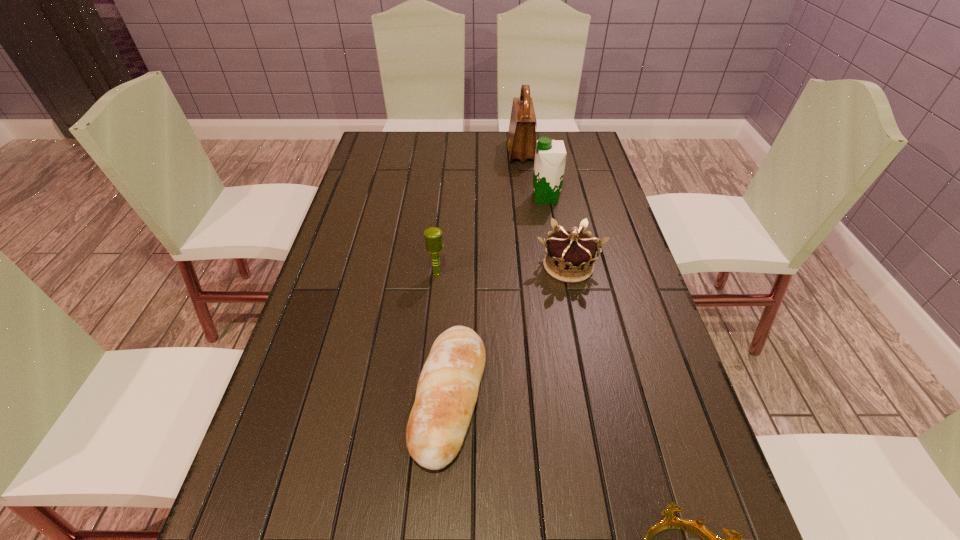
At what (x,y) coordinates should I click in order to perform the action: click on free point located on the front flap of the farthest object. Please return your answer as a coordinate pair (x, y). The image size is (960, 540). Looking at the image, I should click on (459, 152).

The height and width of the screenshot is (540, 960). I want to click on vacant area situated on the front-facing side of the second farthest object, so click(x=498, y=198).

Identify the location of vacant area located 0.080m on the front-facing side of the second farthest object. (507, 198).

Locate an element on the screen. vacant region located on the front-facing side of the second farthest object is located at coordinates (501, 198).

At what (x,y) coordinates should I click in order to perform the action: click on free location located 0.170m on the left of the microphone. Please return your answer as a coordinate pair (x, y). The height and width of the screenshot is (540, 960). Looking at the image, I should click on (366, 273).

This screenshot has width=960, height=540. What are the coordinates of `free spot located on the back of the taller crown` in the screenshot? It's located at (552, 186).

At what (x,y) coordinates should I click in order to perform the action: click on vacant space positioned on the left of the second shortest object. Please return your answer as a coordinate pair (x, y). Looking at the image, I should click on (280, 397).

Locate an element on the screen. The width and height of the screenshot is (960, 540). object that is at the far edge is located at coordinates (521, 145).

The image size is (960, 540). In order to click on object situated at the right edge in this screenshot , I will do `click(570, 255)`.

The width and height of the screenshot is (960, 540). Identify the location of free region at the far edge. (444, 156).